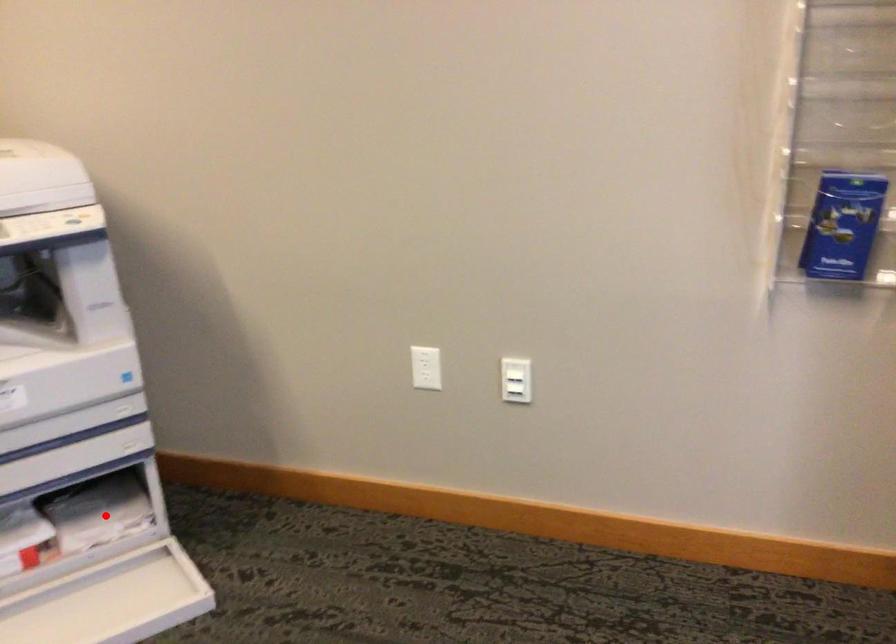
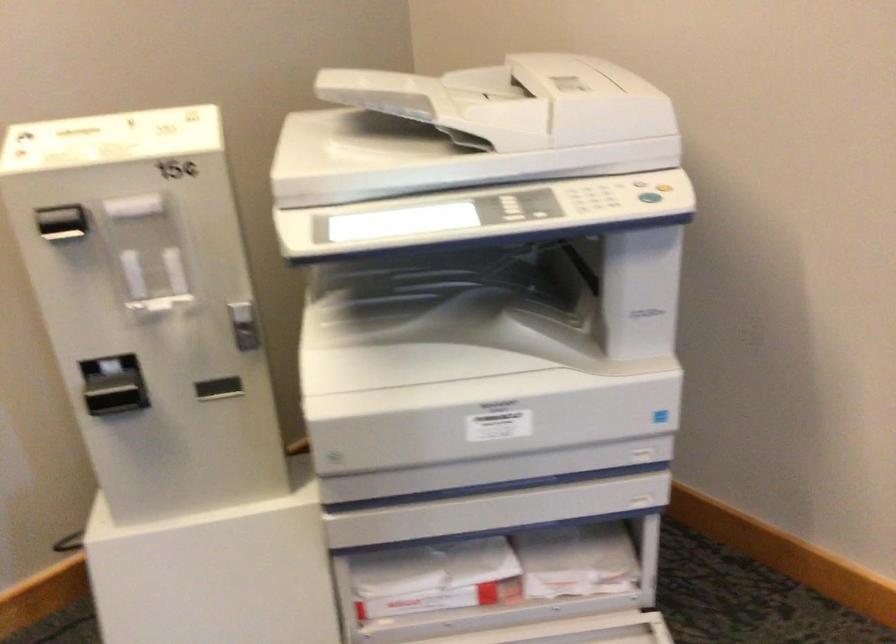
The point at the highlighted location is marked in the first image. Where is the corresponding point in the second image?

(576, 561)